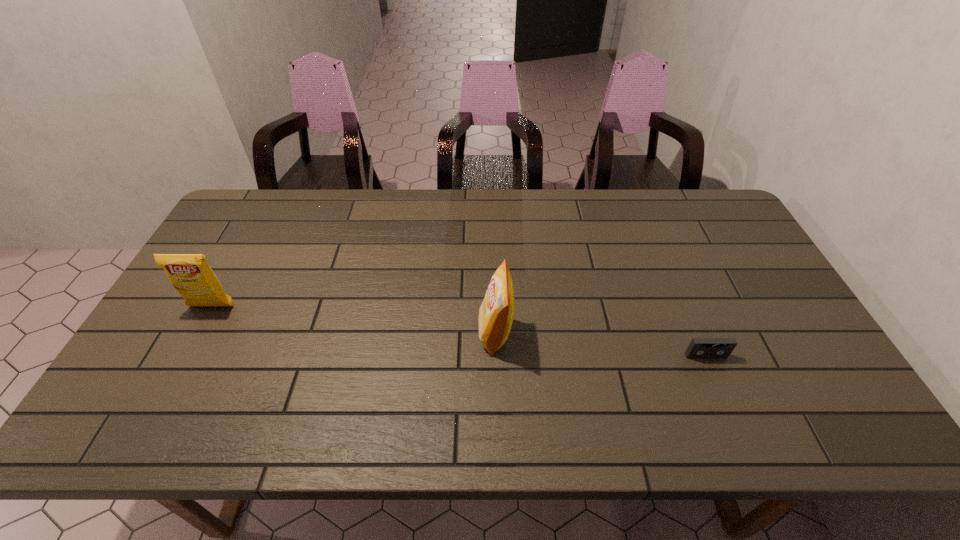
The width and height of the screenshot is (960, 540). Identify the location of blank region between the leftmost object and the videotape. (459, 331).

You are a GUI agent. You are given a task and a screenshot of the screen. Output one action in this format:
    pyautogui.click(x=<x>, y=<y>)
    Task: Click on the blank region between the videotape and the leftmost object
    The width and height of the screenshot is (960, 540).
    Given the screenshot: What is the action you would take?
    pyautogui.click(x=459, y=331)

The height and width of the screenshot is (540, 960). Find the location of `free space between the rightmost object and the leftmost object`. free space between the rightmost object and the leftmost object is located at coordinates (459, 331).

Identify the location of free point between the rightmost object and the leftmost object. The width and height of the screenshot is (960, 540). (459, 331).

The height and width of the screenshot is (540, 960). Identify the location of free space between the leftmost object and the right crisp (potato chip). (353, 320).

Where is `vacant region between the second object from left to right and the left crisp (potato chip)`? This screenshot has height=540, width=960. vacant region between the second object from left to right and the left crisp (potato chip) is located at coordinates (353, 320).

Where is `object that stands as the closest to the second object from left to right`? Image resolution: width=960 pixels, height=540 pixels. object that stands as the closest to the second object from left to right is located at coordinates pyautogui.click(x=699, y=347).

Select which object is the closest to the videotape. Please provide its 2D coordinates. Your answer should be formatted as a tuple, i.e. [(x, y)], where the tuple contains the x and y coordinates of a point satisfying the conditions above.

[(496, 313)]